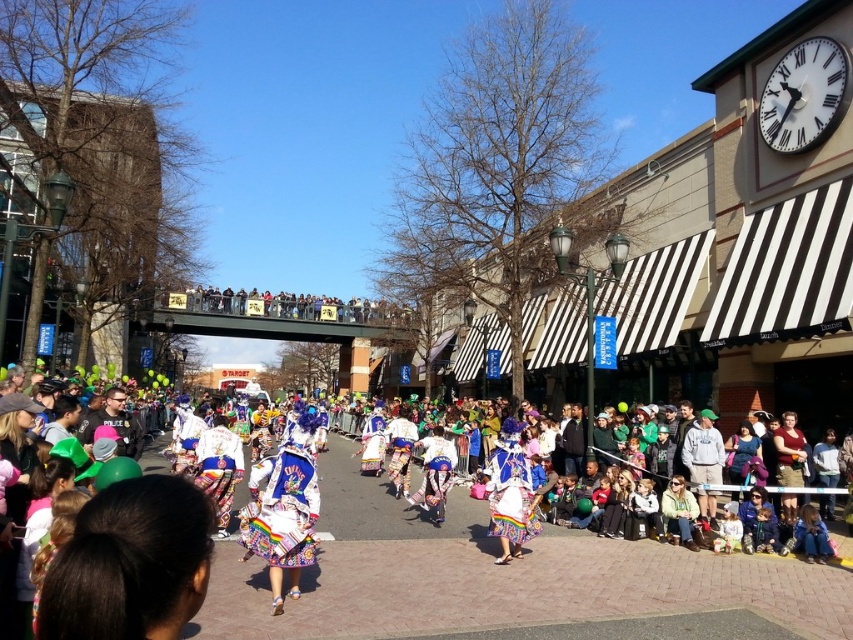
Question: Which point appears farthest from the camera in this image?

Choices:
 (A) (486, 486)
 (B) (126, 515)

Answer: (A)

Question: Which of the following is the farthest from the observer?

Choices:
 (A) white satin dress at center
 (B) multicolored fabric skirt at center
 (C) gray cotton hoodie at center

Answer: (C)

Question: Is multicolored fabric skirt at center below gray cotton hoodie at center?

Choices:
 (A) yes
 (B) no

Answer: (B)

Question: Is colorful fabric dancer at center bigger than gray cotton hoodie at center?

Choices:
 (A) yes
 (B) no

Answer: (A)

Question: Is white satin dress at center wider than colorful fabric dancer at center?

Choices:
 (A) yes
 (B) no

Answer: (A)

Question: Which object appears closest to the camera in this image?

Choices:
 (A) colorful fabric dancers at center
 (B) colorful fabric dancer at center

Answer: (A)